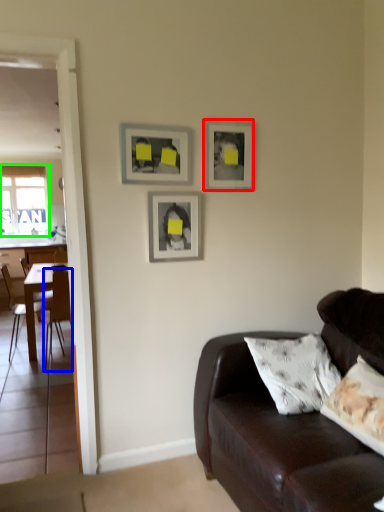
Question: Which object is positioned closest to picture frame (highlighted by a red box)? Select from chair (highlighted by a blue box) and window (highlighted by a green box).

Choices:
 (A) chair
 (B) window

Answer: (A)